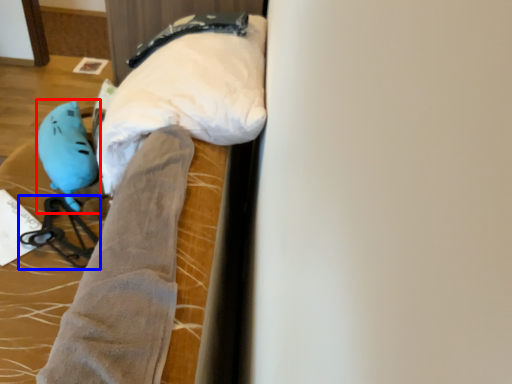
Question: Which point is further to the camera, toy (highlighted by a red box) or twin (highlighted by a blue box)?

Choices:
 (A) toy
 (B) twin

Answer: (A)